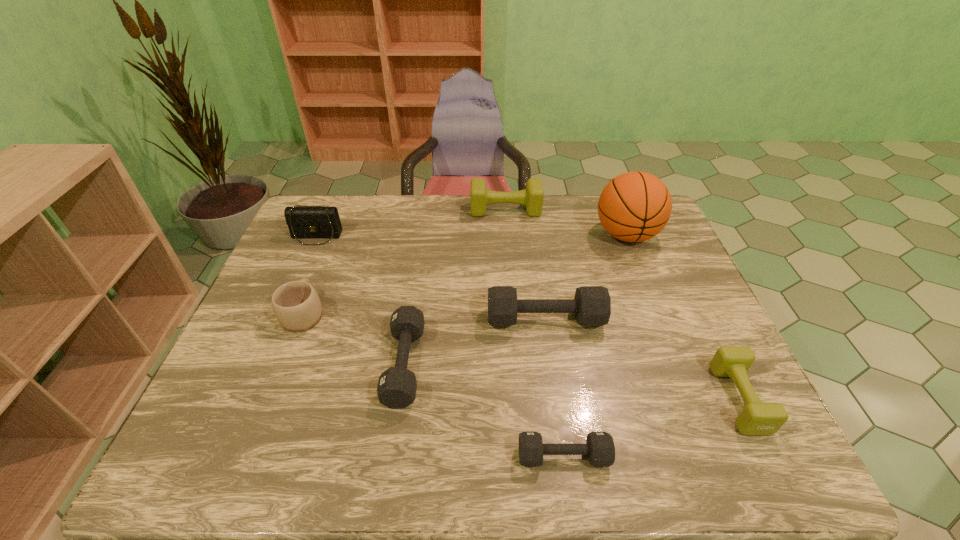
At what (x,y) coordinates should I click in order to perform the action: click on object that is at the far left corner. Please return your answer as a coordinate pair (x, y). Image resolution: width=960 pixels, height=540 pixels. Looking at the image, I should click on (312, 222).

Where is `object at the far right corner`? object at the far right corner is located at coordinates (635, 206).

Locate an element on the screen. The image size is (960, 540). object that is at the near right corner is located at coordinates (757, 418).

You are a GUI agent. You are given a task and a screenshot of the screen. Output one action in this format:
    pyautogui.click(x=<x>, y=<y>)
    Task: Click on the vacant space at the far edge of the desktop
    
    Given the screenshot: What is the action you would take?
    pyautogui.click(x=446, y=200)

The width and height of the screenshot is (960, 540). In order to click on blank space at the near edge of the desktop in this screenshot , I will do `click(385, 460)`.

I want to click on vacant space at the left edge, so click(x=320, y=281).

Where is `free region at the right edge of the desktop`? Image resolution: width=960 pixels, height=540 pixels. free region at the right edge of the desktop is located at coordinates (698, 352).

Find the location of a particular element. The image size is (960, 540). free space that is in between the biggest gray dumbbell and the nearer olive dumbbell is located at coordinates (642, 359).

This screenshot has width=960, height=540. I want to click on vacant area between the left olive dumbbell and the leftmost gray dumbbell, so click(455, 287).

Image resolution: width=960 pixels, height=540 pixels. Find the location of `free space between the third object from left to right and the biggest gray dumbbell`. free space between the third object from left to right and the biggest gray dumbbell is located at coordinates (475, 341).